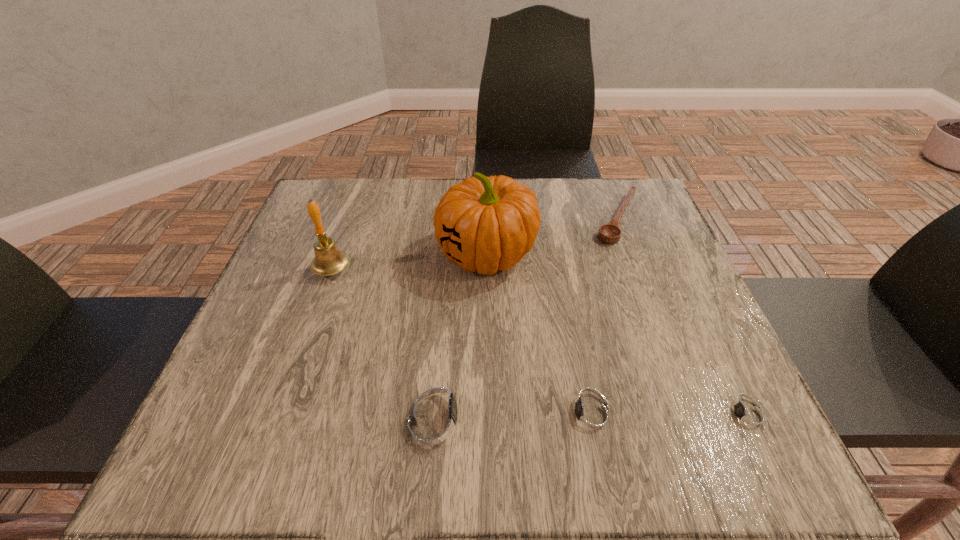
This screenshot has width=960, height=540. I want to click on vacant point located between the shortest object and the second shortest watch, so click(x=670, y=415).

Where is `free space between the wooden spoon and the shortest object`? The width and height of the screenshot is (960, 540). free space between the wooden spoon and the shortest object is located at coordinates (683, 317).

Point out which object is positioned as the fifth nearest to the pumpkin. Please provide its 2D coordinates. Your answer should be formatted as a tuple, i.e. [(x, y)], where the tuple contains the x and y coordinates of a point satisfying the conditions above.

[(747, 415)]

Identify which object is the third nearest to the leftmost watch. Please provide its 2D coordinates. Your answer should be formatted as a tuple, i.e. [(x, y)], where the tuple contains the x and y coordinates of a point satisfying the conditions above.

[(329, 260)]

Locate an element on the screen. watch that is the third closest to the leftmost object is located at coordinates (747, 415).

The image size is (960, 540). What are the coordinates of `the second closest watch to the second shortest watch` in the screenshot? It's located at [x=747, y=415].

The height and width of the screenshot is (540, 960). In order to click on free space in the image that satisfies the following two spatial constraints: 1. on the front side of the wooden spoon; 2. on the face of the second watch from right to left in this screenshot , I will do `click(690, 415)`.